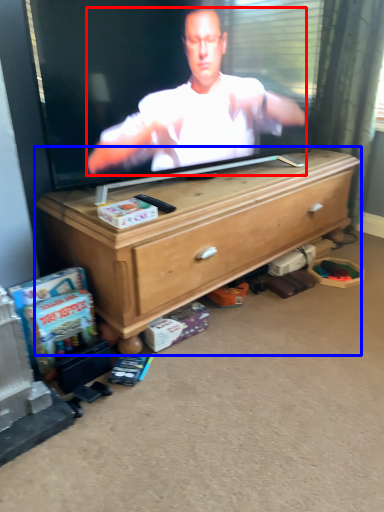
Question: Which of the following is the closest to the observer, person (highlighted by a red box) or chest of drawers (highlighted by a blue box)?

Choices:
 (A) person
 (B) chest of drawers

Answer: (A)